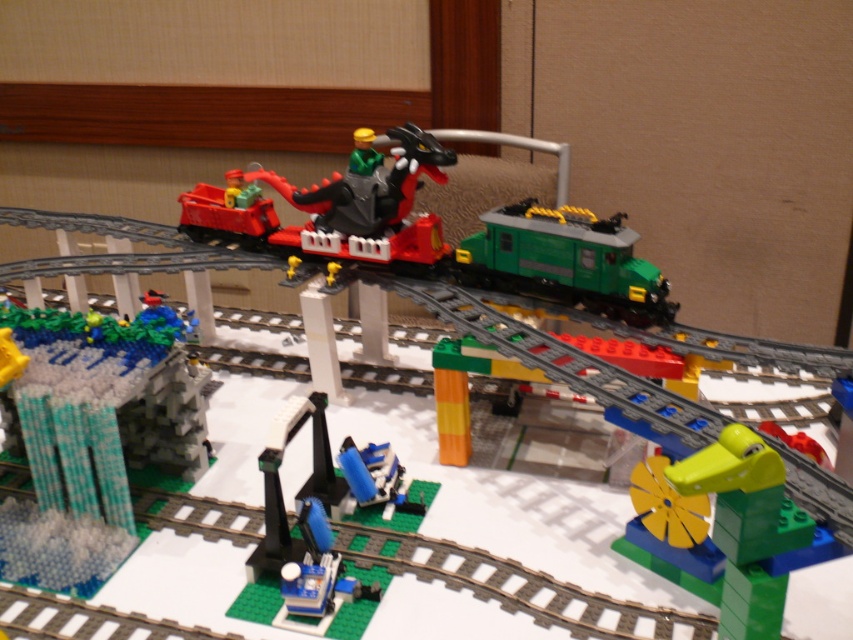
Question: Is shiny green plastic crocodile at center closer to the viewer compared to green matte train car at center-right?

Choices:
 (A) yes
 (B) no

Answer: (A)

Question: Which of the following is the farthest from the observer?

Choices:
 (A) yellow matte figure at center
 (B) translucent blue water at lower left

Answer: (A)

Question: From the image, what is the correct spatial relationship of shiny green plastic crocodile at center in relation to green matte train car at center-right?

Choices:
 (A) left
 (B) right

Answer: (B)

Question: Which of the following is the closest to the observer?

Choices:
 (A) (485, 256)
 (B) (33, 564)
 (C) (733, 522)

Answer: (C)

Question: Is translucent blue water at lower left positioned behind yellow matte figure at center?

Choices:
 (A) yes
 (B) no

Answer: (B)

Question: Which of the following is the farthest from the observer?

Choices:
 (A) yellow matte figure at center
 (B) green matte train car at center-right

Answer: (A)